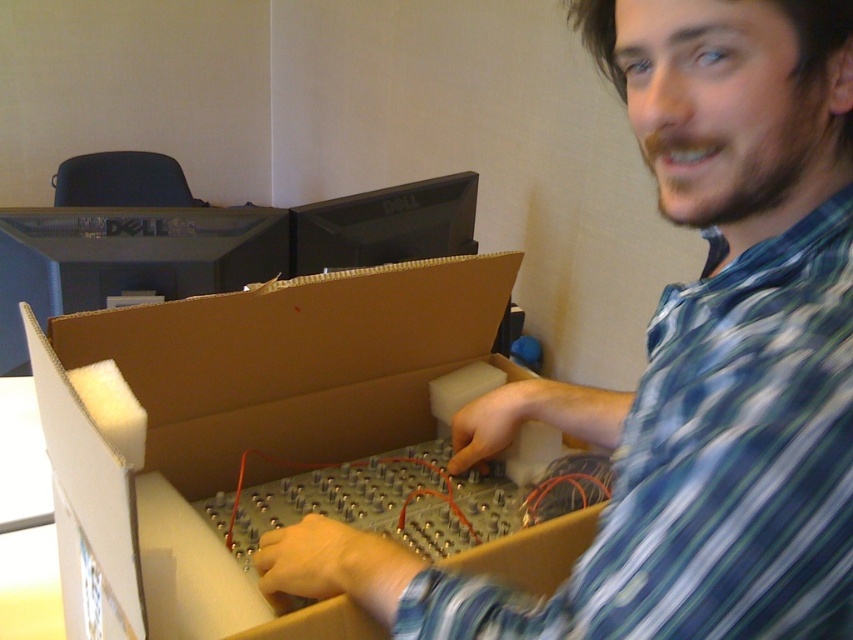
Does point (396, 547) lie in front of point (573, 552)?

Yes, point (396, 547) is in front of point (573, 552).

Does metallic silver circuit board at center have a lesser height compared to brown cardboard box at center?

No, metallic silver circuit board at center is not shorter than brown cardboard box at center.

Describe the element at coordinates (683, 362) in the screenshot. I see `metallic silver circuit board at center` at that location.

Find the location of a particular element. Image resolution: width=853 pixels, height=640 pixels. metallic silver circuit board at center is located at coordinates (683, 362).